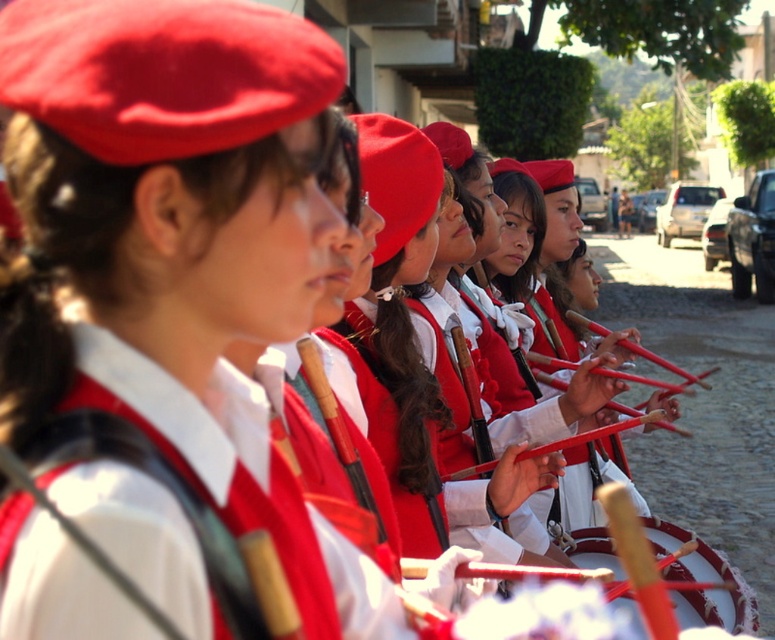
Question: Which point is closer to the camera?

Choices:
 (A) white leather drum at center
 (B) matte red beret at center

Answer: (B)

Question: Can you confirm if matte red beret at center is bigger than white leather drum at center?

Choices:
 (A) no
 (B) yes

Answer: (B)

Question: Considering the relative positions of matte red beret at center and white leather drum at center in the image provided, where is matte red beret at center located with respect to white leather drum at center?

Choices:
 (A) above
 (B) below

Answer: (A)

Question: Among these objects, which one is farthest from the camera?

Choices:
 (A) matte red beret at center
 (B) white leather drum at center

Answer: (B)

Question: From the image, what is the correct spatial relationship of matte red beret at center in relation to white leather drum at center?

Choices:
 (A) left
 (B) right

Answer: (A)